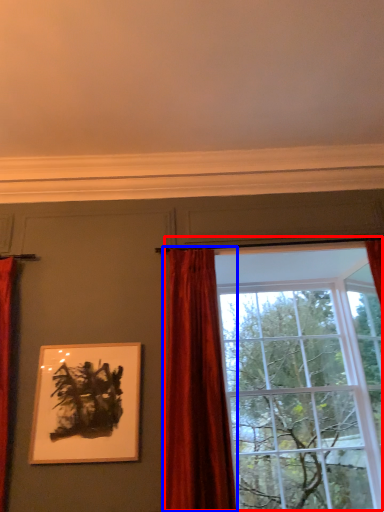
Question: Which object appears closest to the camera in this image, window (highlighted by a red box) or curtain (highlighted by a blue box)?

Choices:
 (A) window
 (B) curtain

Answer: (B)